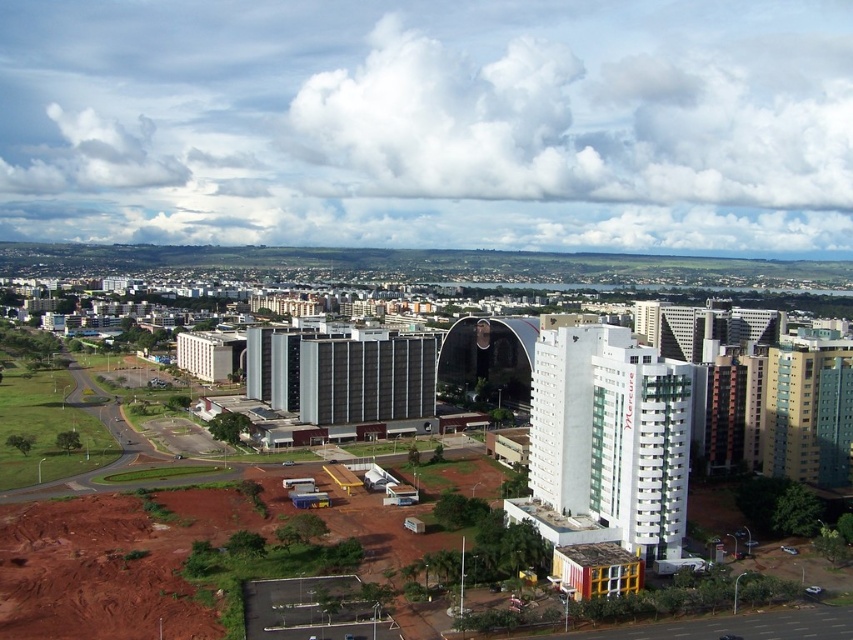
Question: Which point is farther to the camera?

Choices:
 (A) (648, 563)
 (B) (326, 342)
 (C) (207, 353)

Answer: (C)

Question: Observing the image, what is the correct spatial positioning of white smooth building at center in reference to metallic gray building at center?

Choices:
 (A) below
 (B) above

Answer: (A)

Question: Which of these objects is positioned farthest from the metallic gray building at center?

Choices:
 (A) white smooth building at center
 (B) white smooth building at center-left

Answer: (A)

Question: Which point is farther to the camera?

Choices:
 (A) white smooth building at center-left
 (B) metallic gray building at center

Answer: (A)

Question: Does metallic gray building at center appear under white smooth building at center-left?

Choices:
 (A) no
 (B) yes

Answer: (B)

Question: Can you confirm if metallic gray building at center is wider than white smooth building at center-left?

Choices:
 (A) yes
 (B) no

Answer: (A)